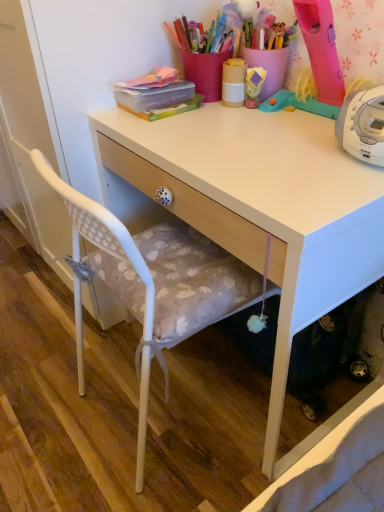
The image size is (384, 512). What are the coordinates of `vacant space to the right of matte yellow cup at upper center` in the screenshot? It's located at (288, 112).